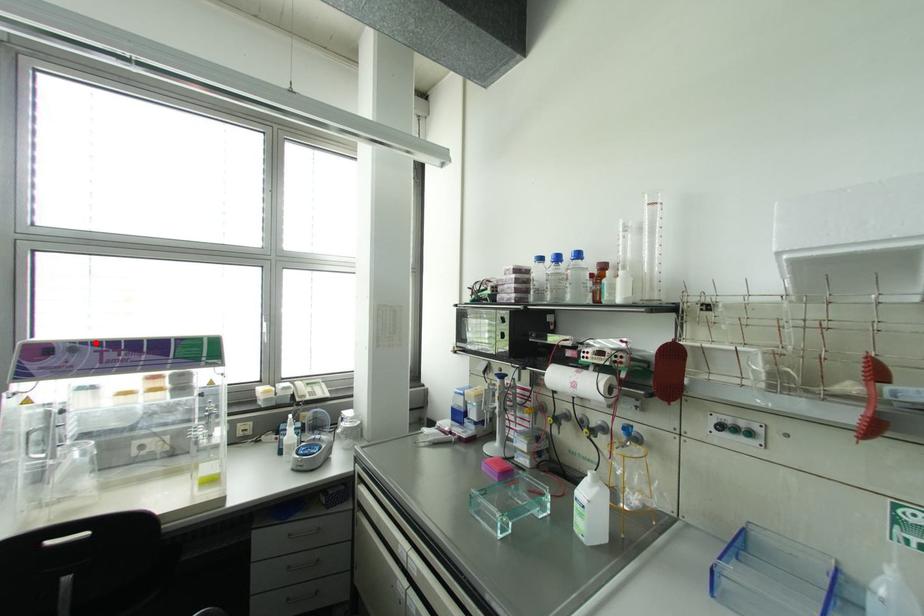
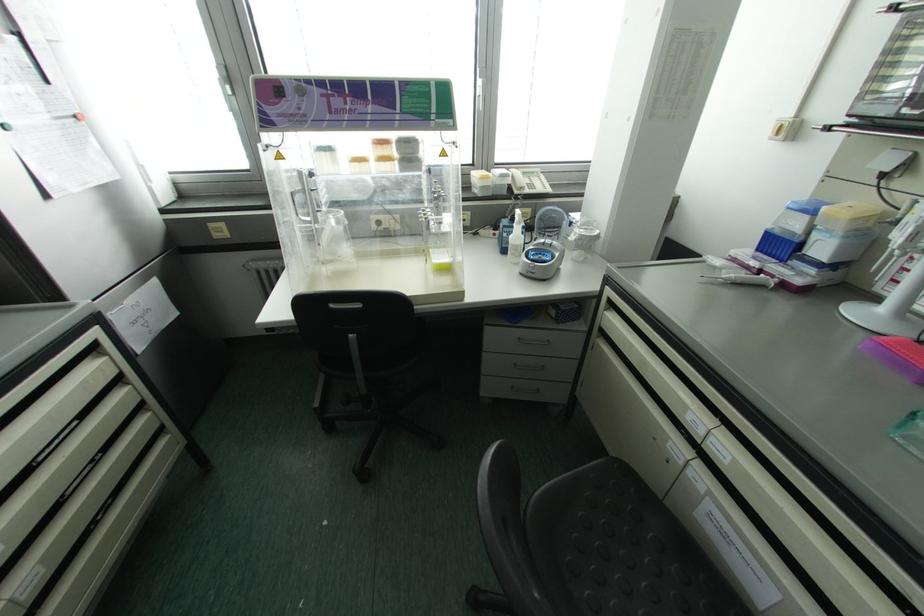
In the second image, find the point that corresponds to the highlighted location in the first image.

(320, 82)